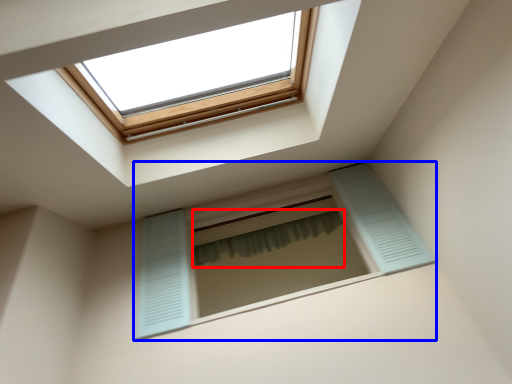
Question: Which of the following is the farthest to the observer, shower curtain (highlighted by a red box) or window (highlighted by a blue box)?

Choices:
 (A) shower curtain
 (B) window

Answer: (A)